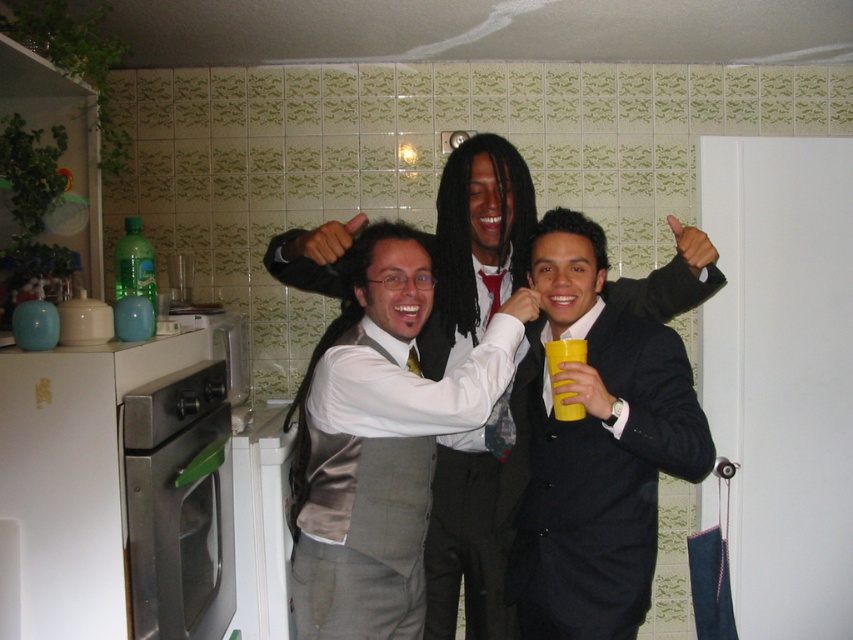
Question: Observing the image, what is the correct spatial positioning of satin gray vest at center in reference to yellow matte cup at center?

Choices:
 (A) right
 (B) left

Answer: (B)

Question: Which is nearer to the green plastic bottle at left?

Choices:
 (A) yellow matte cup at center
 (B) black satin suit at center

Answer: (B)

Question: Among these points, which one is nearest to the camera?

Choices:
 (A) (532, 595)
 (B) (549, 369)
 (C) (125, 269)

Answer: (B)

Question: Can you confirm if black satin suit at center is positioned below yellow matte cup at center?

Choices:
 (A) yes
 (B) no

Answer: (A)

Question: Which object is farther from the camera taking this photo?

Choices:
 (A) yellow matte cup at center
 (B) green plastic bottle at left
 (C) satin gray vest at center

Answer: (B)

Question: Is satin gray vest at center thinner than green plastic bottle at left?

Choices:
 (A) yes
 (B) no

Answer: (B)